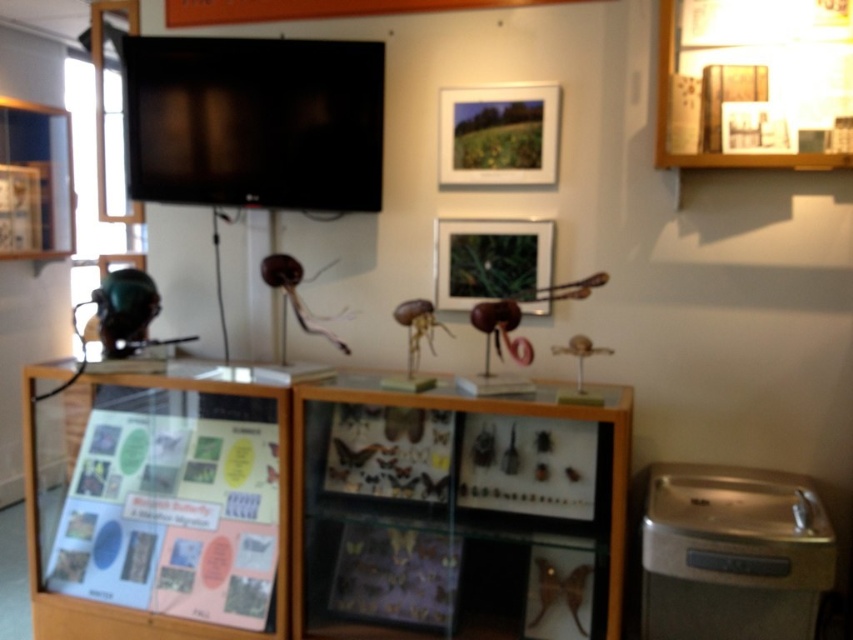
You are an art student who wants to hang a new painting in the museum. You notice the matte wooden picture frame at upper center and the matte black picture frame at center. Which frame has a larger size?

The matte wooden picture frame at upper center is bigger than the matte black picture frame at center, so the matte wooden picture frame at upper center has a larger size.

You are standing in the museum exhibit and need to locate the wooden display case at center. According to the coordinates provided, where exactly is it positioned?

The wooden display case at center is located at point coordinates of 0.800 in the x axis and 0.402 in the y axis.